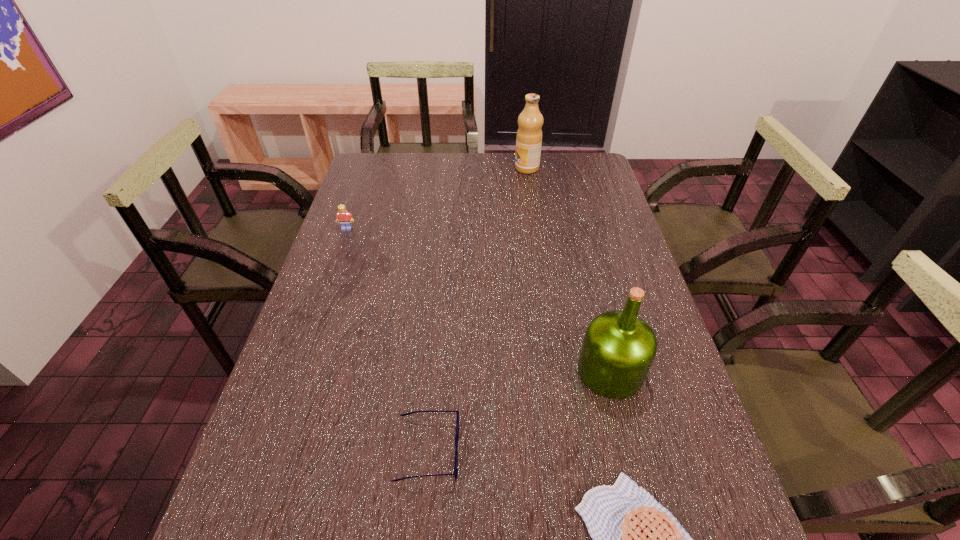
Where is `the left olive oil`? This screenshot has width=960, height=540. the left olive oil is located at coordinates (529, 134).

Find the location of a particular element. This screenshot has width=960, height=540. the farthest object is located at coordinates (529, 134).

Locate an element on the screen. This screenshot has height=540, width=960. the third nearest object is located at coordinates (619, 347).

Where is `the right olive oil`? Image resolution: width=960 pixels, height=540 pixels. the right olive oil is located at coordinates (619, 347).

I want to click on the fourth nearest object, so click(343, 216).

Locate an element on the screen. the third shortest object is located at coordinates (343, 216).

You are a GUI agent. You are given a task and a screenshot of the screen. Output one action in this format:
    pyautogui.click(x=<x>, y=<y>)
    Task: Click on the spectacles
    
    Given the screenshot: What is the action you would take?
    pyautogui.click(x=457, y=412)

Locate an element on the screen. vacant area situated 0.160m on the label of the farther olive oil is located at coordinates (473, 168).

The width and height of the screenshot is (960, 540). Identify the location of free spot located 0.110m on the label of the farther olive oil. (486, 168).

At what (x,y) coordinates should I click in order to perform the action: click on vacant space located 0.320m on the label of the farther olive oil. Please return your answer as a coordinate pair (x, y). This screenshot has width=960, height=540. Looking at the image, I should click on (431, 168).